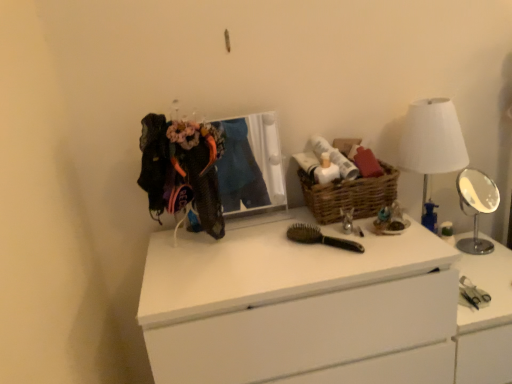
This screenshot has width=512, height=384. What do you see at coordinates (321, 309) in the screenshot?
I see `white matte chest of drawers at center` at bounding box center [321, 309].

Describe the element at coordinates (486, 319) in the screenshot. I see `white plastic vanity at right` at that location.

The height and width of the screenshot is (384, 512). I want to click on white plastic vanity at right, so click(x=486, y=319).

Describe the element at coordinates (182, 169) in the screenshot. I see `knitted fabric clothesline at upper left` at that location.

What do you see at coordinates (432, 140) in the screenshot?
I see `white fabric lampshade at right` at bounding box center [432, 140].

In order to click on white fabric lampshade at right in this screenshot , I will do `click(432, 140)`.

You are a GUI agent. You are given a task and a screenshot of the screen. Output one action in this format:
    pyautogui.click(x=<x>, y=<y>)
    Task: Click on the black wooden hairbrush at center
    The image size is (512, 384).
    Given the screenshot: What is the action you would take?
    pyautogui.click(x=320, y=238)

Does white matte chest of drawers at center have a greater width compared to white plastic vanity at right?

Yes, white matte chest of drawers at center is wider than white plastic vanity at right.

Based on their positions, is white matte chest of drawers at center located to the left or right of white plastic vanity at right?

Based on their positions, white matte chest of drawers at center is located to the left of white plastic vanity at right.

From a real-world perspective, is white matte chest of drawers at center below white plastic vanity at right?

No.

Can you confirm if white matte chest of drawers at center is smaller than white plastic vanity at right?

No.

Which is more to the left, knitted fabric clothesline at upper left or woven brown basket at center?

Positioned to the left is knitted fabric clothesline at upper left.

From a real-world perspective, is knitted fabric clothesline at upper left positioned above or below woven brown basket at center?

knitted fabric clothesline at upper left is situated higher than woven brown basket at center in the real world.

What's the angular difference between knitted fabric clothesline at upper left and woven brown basket at center's facing directions?

The facing directions of knitted fabric clothesline at upper left and woven brown basket at center are 0.389 degrees apart.

Would you consider knitted fabric clothesline at upper left to be distant from woven brown basket at center?

They are positioned close to each other.

In the image, is white plastic vanity at right on the left side or the right side of white matte chest of drawers at center?

white plastic vanity at right is positioned on white matte chest of drawers at center's right side.

Is white plastic vanity at right wider or thinner than white matte chest of drawers at center?

Clearly, white plastic vanity at right has less width compared to white matte chest of drawers at center.

From a real-world perspective, does white plastic vanity at right stand above white matte chest of drawers at center?

No.

Does white plastic vanity at right lie behind white matte chest of drawers at center?

That is True.

Could you tell me if knitted fabric clothesline at upper left is turned towards white plastic vanity at right?

No, knitted fabric clothesline at upper left is not turned towards white plastic vanity at right.

Is knitted fabric clothesline at upper left positioned beyond the bounds of white plastic vanity at right?

knitted fabric clothesline at upper left lies outside white plastic vanity at right's area.

From the image's perspective, which one is positioned higher, knitted fabric clothesline at upper left or white plastic vanity at right?

From the image's view, knitted fabric clothesline at upper left is above.

Who is smaller, knitted fabric clothesline at upper left or white plastic vanity at right?

knitted fabric clothesline at upper left is smaller.

How different are the orientations of woven brown basket at center and black wooden hairbrush at center in degrees?

43.3 degrees separate the facing orientations of woven brown basket at center and black wooden hairbrush at center.

Is woven brown basket at center not inside black wooden hairbrush at center?

Yes, woven brown basket at center is not within black wooden hairbrush at center.

Is point (312, 205) positioned behind point (296, 232)?

Yes, it is behind point (296, 232).

Considering the sizes of objects woven brown basket at center and black wooden hairbrush at center in the image provided, who is wider, woven brown basket at center or black wooden hairbrush at center?

With larger width is black wooden hairbrush at center.

Is the surface of white plastic vanity at right in direct contact with knitted fabric clothesline at upper left?

They are not placed beside each other.

Considering the relative sizes of white plastic vanity at right and knitted fabric clothesline at upper left in the image provided, is white plastic vanity at right smaller than knitted fabric clothesline at upper left?

No, white plastic vanity at right is not smaller than knitted fabric clothesline at upper left.

Is point (479, 282) closer to viewer compared to point (208, 153)?

No, it is behind (208, 153).

Is silver metallic mirror at right turned away from white plastic vanity at right?

No, silver metallic mirror at right is not facing the opposite direction of white plastic vanity at right.

Is silver metallic mirror at right not near white plastic vanity at right?

No, silver metallic mirror at right is not far away from white plastic vanity at right.

From the picture: Between silver metallic mirror at right and white plastic vanity at right, which one appears on the right side from the viewer's perspective?

silver metallic mirror at right is more to the right.

This screenshot has width=512, height=384. I want to click on chest of drawers in front of the white plastic vanity at right, so click(x=321, y=309).

Find the location of a particular element. picnic basket below the knitted fabric clothesline at upper left (from a real-world perspective) is located at coordinates (349, 195).

Considering their positions, is white fabric lampshade at right positioned closer to silver metallic mirror at right than white matte chest of drawers at center?

white fabric lampshade at right is positioned closer to the anchor silver metallic mirror at right.

From the image, which object appears to be farther from silver metallic mirror at right, black wooden hairbrush at center or white matte chest of drawers at center?

The object further to silver metallic mirror at right is black wooden hairbrush at center.

Looking at the image, which one is located closer to silver metallic mirror at right, black wooden hairbrush at center or white plastic vanity at right?

Among the two, white plastic vanity at right is located nearer to silver metallic mirror at right.

Based on their spatial positions, is silver metallic mirror at right or white fabric lampshade at right further from woven brown basket at center?

silver metallic mirror at right.

Which object lies nearer to the anchor point white matte chest of drawers at center, woven brown basket at center or silver metallic mirror at right?

woven brown basket at center is closer to white matte chest of drawers at center.

Which object lies nearer to the anchor point white plastic vanity at right, knitted fabric clothesline at upper left or white fabric lampshade at right?

white fabric lampshade at right is closer to white plastic vanity at right.

Based on the photo, looking at the image, which one is located closer to white plastic vanity at right, silver metallic mirror at right or white matte chest of drawers at center?

Among the two, silver metallic mirror at right is located nearer to white plastic vanity at right.

Considering their positions, is silver metallic mirror at right positioned closer to knitted fabric clothesline at upper left than black wooden hairbrush at center?

Based on the image, black wooden hairbrush at center appears to be nearer to knitted fabric clothesline at upper left.

Identify the location of mirror between white fabric lampshade at right and white plastic vanity at right in the vertical direction. (476, 206).

Image resolution: width=512 pixels, height=384 pixels. Find the location of `table lamp situated between knitted fabric clothesline at upper left and silver metallic mirror at right from left to right`. table lamp situated between knitted fabric clothesline at upper left and silver metallic mirror at right from left to right is located at coordinates (432, 140).

Find the location of a particular element. The width and height of the screenshot is (512, 384). chest of drawers between knitted fabric clothesline at upper left and silver metallic mirror at right is located at coordinates [x=321, y=309].

This screenshot has height=384, width=512. What are the coordinates of `picnic basket between black wooden hairbrush at center and white plastic vanity at right in the horizontal direction` in the screenshot? It's located at (349, 195).